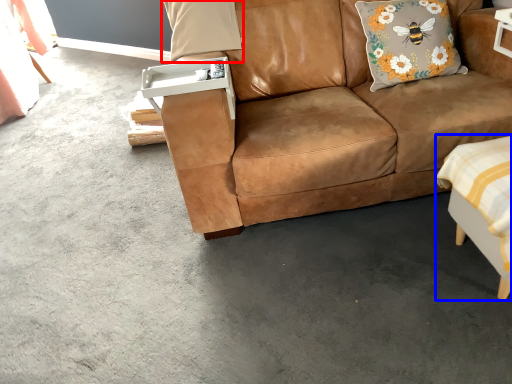
Question: Among these objects, which one is farthest to the camera, pillow (highlighted by a red box) or swivel chair (highlighted by a blue box)?

Choices:
 (A) pillow
 (B) swivel chair

Answer: (A)